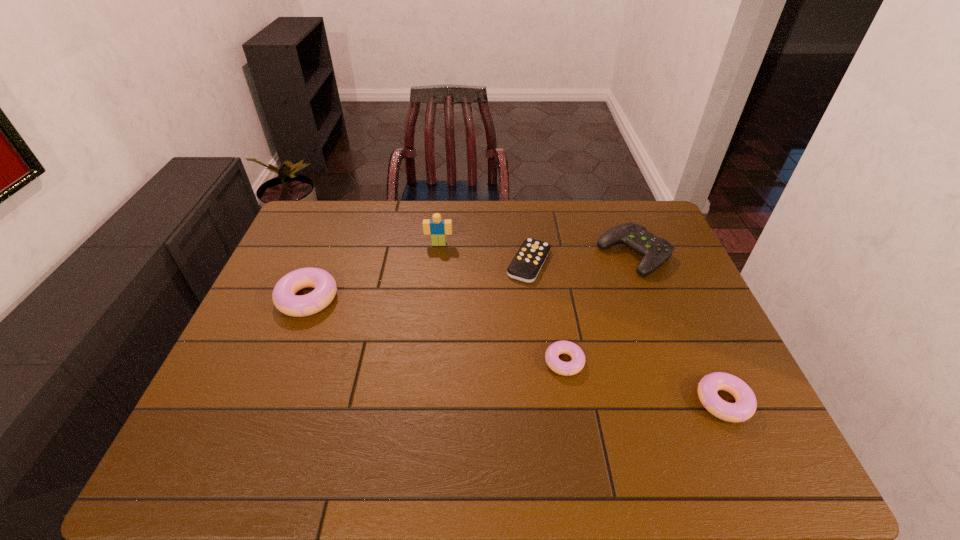
At what (x,y) coordinates should I click in order to perform the action: click on free spot between the second shortest doughnut and the remote control. Please return your answer as a coordinate pair (x, y). Looking at the image, I should click on (626, 332).

This screenshot has height=540, width=960. I want to click on free spot between the third shortest object and the leftmost doughnut, so click(516, 350).

Where is `vacant area that lies between the farthest doughnut and the fourth tallest object`? vacant area that lies between the farthest doughnut and the fourth tallest object is located at coordinates (516, 350).

Identify the location of free space between the control and the remote control. Image resolution: width=960 pixels, height=540 pixels. (581, 259).

At what (x,y) coordinates should I click in order to perform the action: click on vacant region between the control and the shortest object. Please return your answer as a coordinate pair (x, y). This screenshot has height=540, width=960. Looking at the image, I should click on (581, 259).

The width and height of the screenshot is (960, 540). What are the coordinates of `vacant area between the second tallest doughnut and the shortest object` in the screenshot? It's located at (626, 332).

Where is `free spot between the leftmost doughnut and the tallest object`? This screenshot has height=540, width=960. free spot between the leftmost doughnut and the tallest object is located at coordinates (373, 271).

Where is `object that can be found as the third closest to the second doughnut from left to right`? The height and width of the screenshot is (540, 960). object that can be found as the third closest to the second doughnut from left to right is located at coordinates point(655,250).

Find the location of a particular element. The width and height of the screenshot is (960, 540). the third closest object to the control is located at coordinates (745, 406).

This screenshot has width=960, height=540. Identify the location of doughnut that is the second closest to the remote control. (745, 406).